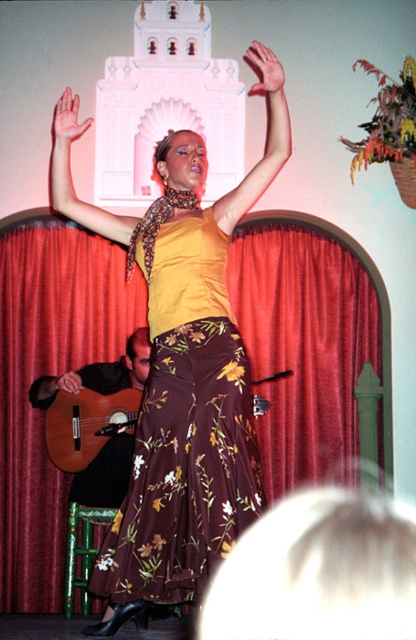
Does floral-patterned fabric at center appear on the left side of smooth skin hand at upper center?

Yes, floral-patterned fabric at center is to the left of smooth skin hand at upper center.

Is floral-patterned fabric at center wider than smooth skin hand at upper center?

Indeed, floral-patterned fabric at center has a greater width compared to smooth skin hand at upper center.

Who is more forward, (193, 196) or (265, 96)?

Point (193, 196) is more forward.

The image size is (416, 640). Find the location of `floral-patterned fabric at center`. floral-patterned fabric at center is located at coordinates (156, 225).

Does red velvet curtain at center come in front of smooth skin hand at upper center?

That is False.

Who is more forward, [331,314] or [259,93]?

Point [331,314] is more forward.

Is point (83, 244) behind point (275, 74)?

Yes.

Image resolution: width=416 pixels, height=640 pixels. Identify the location of red velvet curtain at center. (307, 339).

Is point (299, 337) less distant than point (267, 77)?

No.

Looking at this image, is red velvet curtain at center shorter than yellow matte arm at upper center?

No.

This screenshot has height=640, width=416. I want to click on red velvet curtain at center, so click(x=307, y=339).